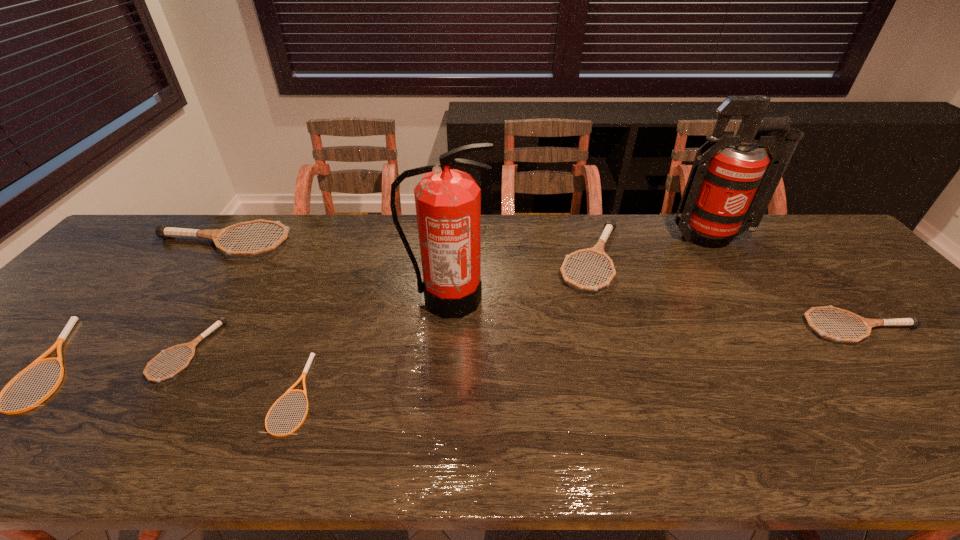
At what (x,y) coordinates should I click in order to perform the action: click on red fire extinguisher. Please return your answer as a coordinate pair (x, y). The image size is (960, 540). Looking at the image, I should click on (729, 188).

The image size is (960, 540). Identify the location of the right fire extinguisher. (729, 188).

Image resolution: width=960 pixels, height=540 pixels. I want to click on black fire extinguisher, so click(x=448, y=202).

You are a GUI agent. You are given a task and a screenshot of the screen. Output one action in this format:
    pyautogui.click(x=<x>, y=<y>)
    Task: Click on the left fire extinguisher
    
    Given the screenshot: What is the action you would take?
    pyautogui.click(x=448, y=202)

Where is `the biggest gray tennis racket`? the biggest gray tennis racket is located at coordinates (164, 231).

At what (x,y) coordinates should I click in order to perform the action: click on the third tallest object. Please return your answer as a coordinate pair (x, y). This screenshot has height=540, width=960. Looking at the image, I should click on (164, 231).

Locate an element on the screen. This screenshot has width=960, height=540. the sixth object from left to right is located at coordinates (598, 249).

This screenshot has width=960, height=540. Find the location of `the fifth tennis racket from left to right`. the fifth tennis racket from left to right is located at coordinates (598, 249).

Find the location of `the fourth shortest object`. the fourth shortest object is located at coordinates (912, 321).

This screenshot has width=960, height=540. In order to click on the third tallest tennis racket in this screenshot , I will do `click(912, 321)`.